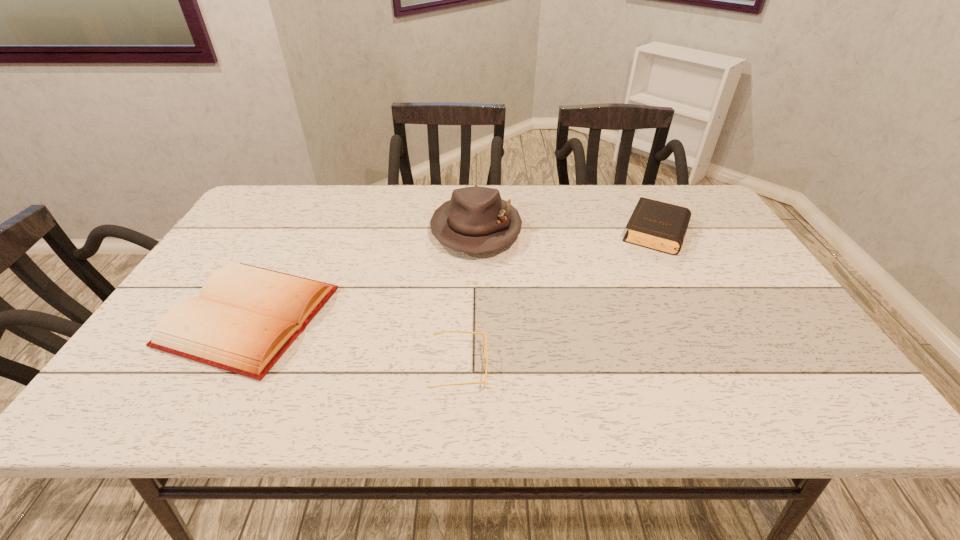
Identify the location of hat. (475, 220).

Locate an element on the screen. The height and width of the screenshot is (540, 960). the rightmost object is located at coordinates pos(660,226).

This screenshot has width=960, height=540. Identify the location of the right Bible. (660, 226).

Image resolution: width=960 pixels, height=540 pixels. Find the location of `the left Bible`. the left Bible is located at coordinates (245, 318).

Find the location of a particular element. The width and height of the screenshot is (960, 540). the leftmost object is located at coordinates (245, 318).

Where is `spectacles`? The image size is (960, 540). spectacles is located at coordinates (484, 337).

I want to click on vacant region located 0.210m on the decorative side of the tallest object, so coord(475,319).

Identify the location of free space located on the back of the right Bible. Image resolution: width=960 pixels, height=540 pixels. (640, 200).

Find the location of a particular element. The height and width of the screenshot is (540, 960). vacant region located 0.320m on the right of the nearer Bible is located at coordinates (465, 316).

At what (x,y) coordinates should I click in order to perform the action: click on blank space located 0.260m in front of the lenses of the spectacles. Please return your answer as a coordinate pair (x, y). The width and height of the screenshot is (960, 540). Looking at the image, I should click on (611, 368).